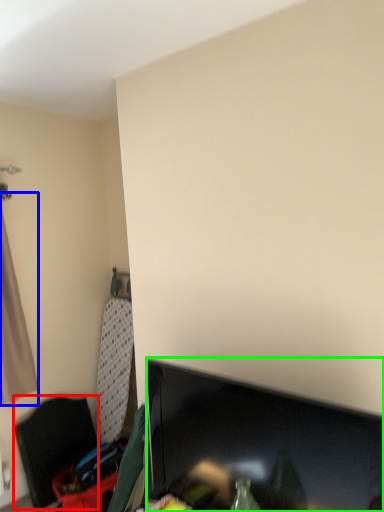
Question: Estimate the real-world distances between objects in this image. Which object is closer to furniture (highlighted by a red box), curtain (highlighted by a blue box) or television (highlighted by a green box)?

Choices:
 (A) curtain
 (B) television

Answer: (A)